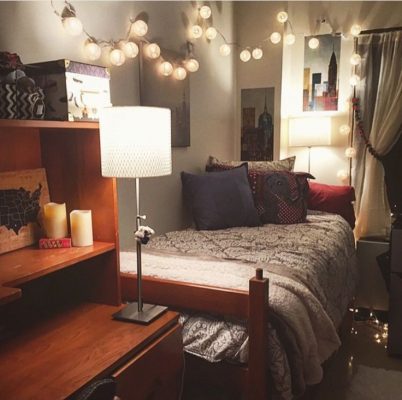
This screenshot has width=402, height=400. Identify the location of map. (16, 203).